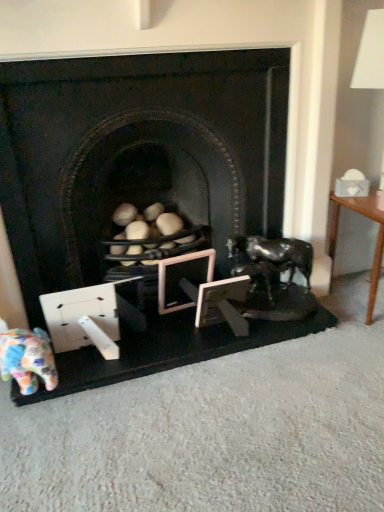
At what (x,y) coordinates should I click in order to perform the action: click on vacant area that is situated to the right of multicolored fabric elephant at lower left. Please return your answer as a coordinate pair (x, y). Looking at the image, I should click on (84, 375).